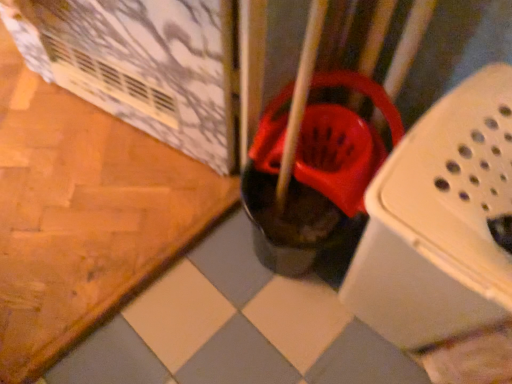
Question: Is rubberized red bucket at center not close to white plastic laundry basket at center?

Choices:
 (A) no
 (B) yes

Answer: (A)

Question: Does rubberized red bucket at center come behind white plastic laundry basket at center?

Choices:
 (A) yes
 (B) no

Answer: (A)

Question: From the image's perspective, is rubberized red bucket at center below white plastic laundry basket at center?

Choices:
 (A) no
 (B) yes

Answer: (A)

Question: From the image's perspective, is rubberized red bucket at center on top of white plastic laundry basket at center?

Choices:
 (A) yes
 (B) no

Answer: (A)

Question: Can you see rubberized red bucket at center touching white plastic laundry basket at center?

Choices:
 (A) yes
 (B) no

Answer: (B)

Question: Is rubberized red bucket at center at the left side of white plastic laundry basket at center?

Choices:
 (A) no
 (B) yes

Answer: (B)

Question: Considering the relative sizes of white plastic laundry basket at center and rubberized red bucket at center in the image provided, is white plastic laundry basket at center wider than rubberized red bucket at center?

Choices:
 (A) yes
 (B) no

Answer: (B)

Question: Considering the relative sizes of white plastic laundry basket at center and rubberized red bucket at center in the image provided, is white plastic laundry basket at center shorter than rubberized red bucket at center?

Choices:
 (A) yes
 (B) no

Answer: (B)

Question: Is white plastic laundry basket at center turned away from rubberized red bucket at center?

Choices:
 (A) no
 (B) yes

Answer: (A)

Question: Are white plastic laundry basket at center and rubberized red bucket at center located far from each other?

Choices:
 (A) yes
 (B) no

Answer: (B)

Question: Is white plastic laundry basket at center directly adjacent to rubberized red bucket at center?

Choices:
 (A) yes
 (B) no

Answer: (B)

Question: Can you confirm if white plastic laundry basket at center is positioned to the left of rubberized red bucket at center?

Choices:
 (A) yes
 (B) no

Answer: (B)

Question: Considering the positions of white plastic laundry basket at center and rubberized red bucket at center in the image, is white plastic laundry basket at center wider or thinner than rubberized red bucket at center?

Choices:
 (A) thin
 (B) wide

Answer: (A)